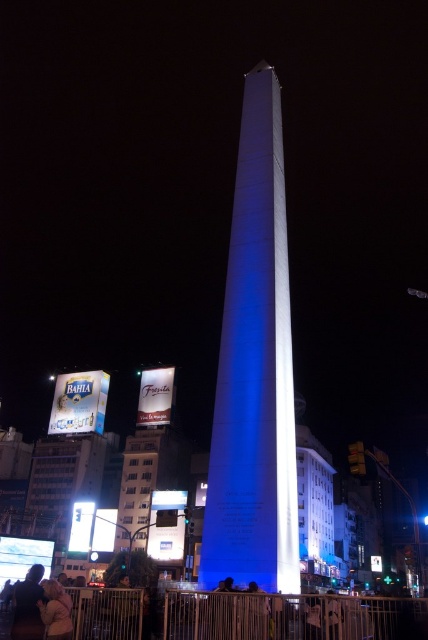
You are a drone operator trying to capture a photo of the white polished stone obelisk at center. Your drone is currently at coordinates point 0.5, 0.6. Which direction should you move the drone to align it with the obelisk?

The white polished stone obelisk at center is located at point (255,369). Since your drone is at (256,320), you should move it northeast to align with the obelisk.

Based on the photo, you are a photographer trying to capture a clear shot of the matte black shirt at lower left and the blonde hair at lower left. Since you want to focus on both, which object should you adjust your camera focus on first considering their height?

The matte black shirt at lower left is much taller than the blonde hair at lower left, so you should focus on the matte black shirt at lower left first as it is taller and likely further away.

You are a delivery drone with a maximum flight range of 70 feet. You need to deliver a package to a person with blonde hair at lower left. The white polished stone obelisk at center is your current location. Can you reach the destination without recharging?

The distance between the white polished stone obelisk at center and the blonde hair at lower left is 68.30 feet, which is within your drone maximum flight range of 70 feet. Yes, you can reach the destination without recharging.